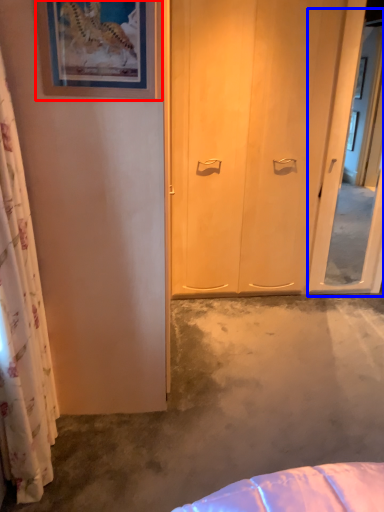
Question: Which point is closer to the camera, picture frame (highlighted by a red box) or screen door (highlighted by a blue box)?

Choices:
 (A) picture frame
 (B) screen door

Answer: (A)